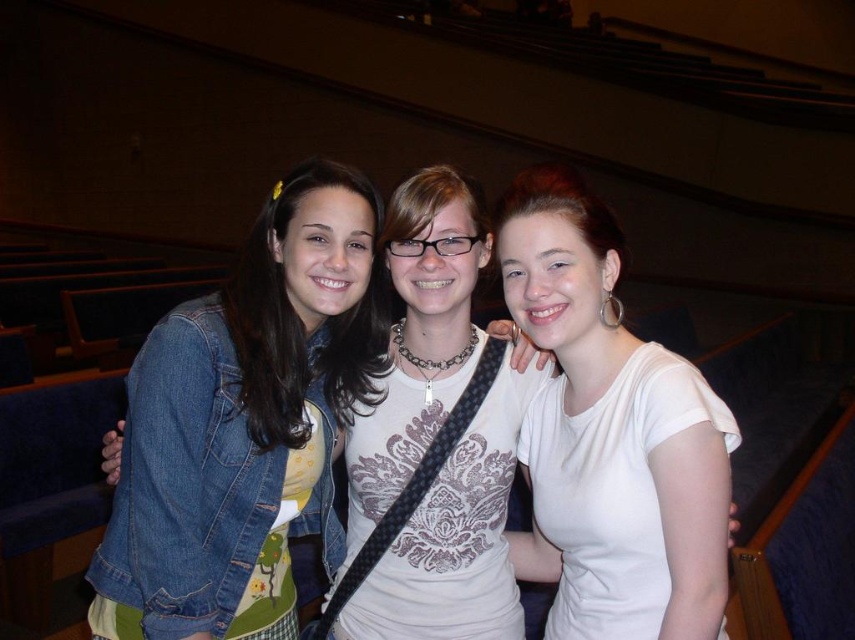
You are organizing a photoshoot and need to ensure that all clothing items are visible in the final image. Given the scene described, will the white matte shirt at center and the denim jacket at center both be fully visible in the photo?

The white matte shirt at center occupies less space than the denim jacket at center, so both items will be fully visible in the photo as they are positioned centrally and do not overlap significantly.

You are standing in a theater and see the denim jacket at left. If you want to find its exact location, what coordinates would you use?

The coordinates for the denim jacket at left are at point 0.664 on the x axis and 0.285 on the y axis.